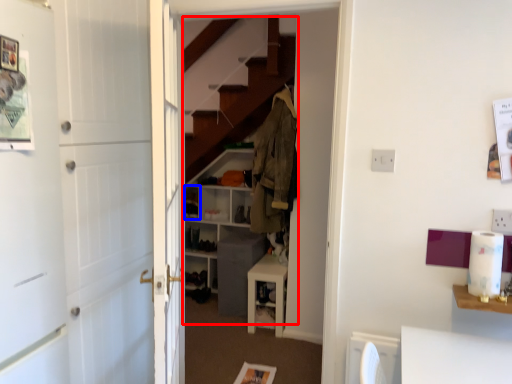
Question: Which of the following is the farthest to the observer, dresser (highlighted by a red box) or shelf (highlighted by a blue box)?

Choices:
 (A) dresser
 (B) shelf

Answer: (B)